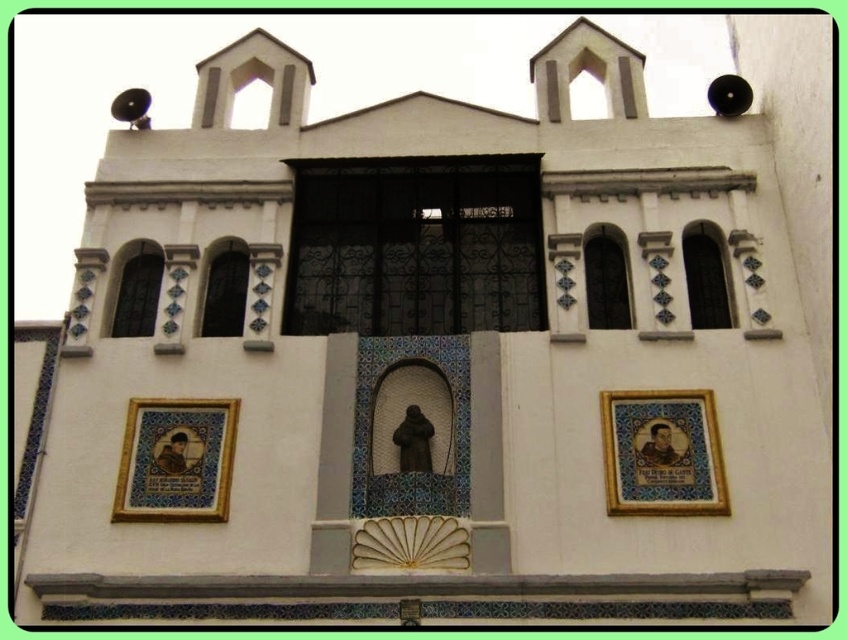
Question: Can you confirm if matte glass window at upper left is bigger than matte glass window at center-left?

Choices:
 (A) yes
 (B) no

Answer: (B)

Question: Estimate the real-world distances between objects in this image. Which object is closer to the matte glass window at center-right?

Choices:
 (A) black wrought iron window at center
 (B) matte glass window at center-left

Answer: (A)

Question: Does black wrought iron window at center appear over matte glass window at center-left?

Choices:
 (A) yes
 (B) no

Answer: (A)

Question: Is black wrought iron window at center to the left of matte glass window at upper left from the viewer's perspective?

Choices:
 (A) no
 (B) yes

Answer: (A)

Question: Which of these objects is positioned farthest from the matte glass window at center-left?

Choices:
 (A) clear glass window at upper right
 (B) matte glass window at center-right
 (C) black wrought iron window at center

Answer: (A)

Question: Which point is farther to the camera?

Choices:
 (A) (728, 324)
 (B) (131, 284)

Answer: (B)